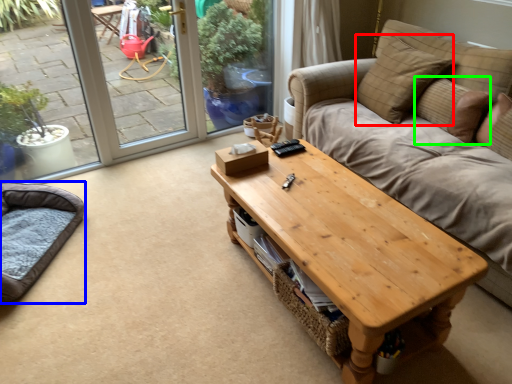
Question: Which is nearer to the pillow (highlighted by a red box)? cat bed (highlighted by a blue box) or pillow (highlighted by a green box).

Choices:
 (A) cat bed
 (B) pillow

Answer: (B)